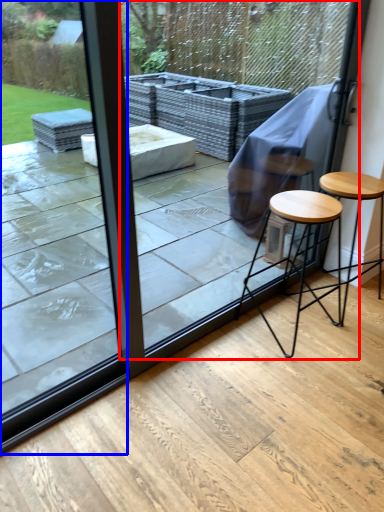
Question: Which object is further to the camera taking this photo, screen door (highlighted by a red box) or glass door (highlighted by a blue box)?

Choices:
 (A) screen door
 (B) glass door

Answer: (A)